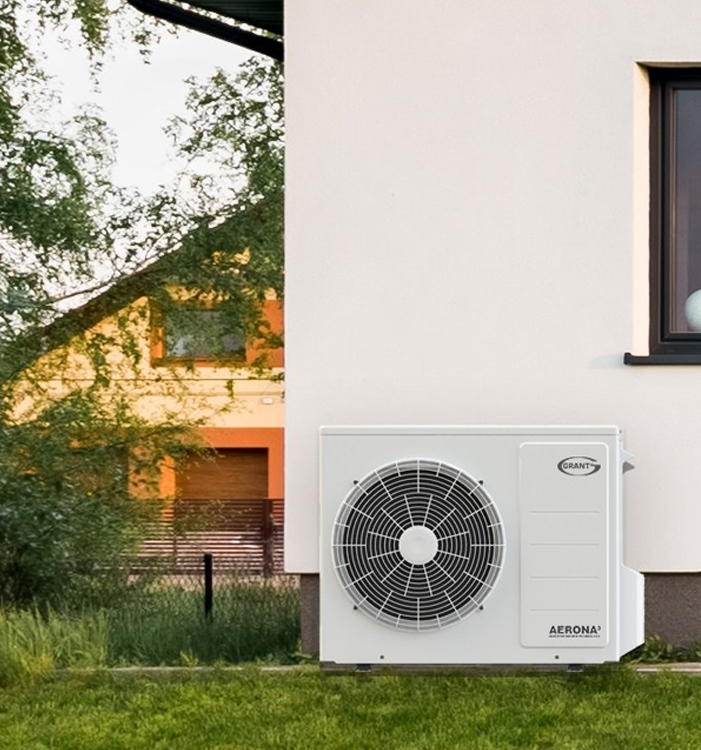
Locate an element on the screen. Image resolution: width=701 pixels, height=750 pixels. cord is located at coordinates (676, 670).